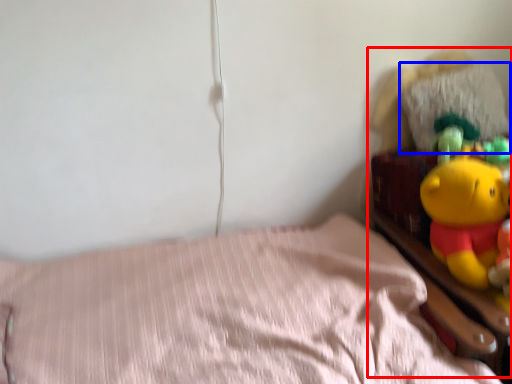
Question: Among these objects, which one is farthest to the camera, toy (highlighted by a red box) or pillow (highlighted by a blue box)?

Choices:
 (A) toy
 (B) pillow

Answer: (B)